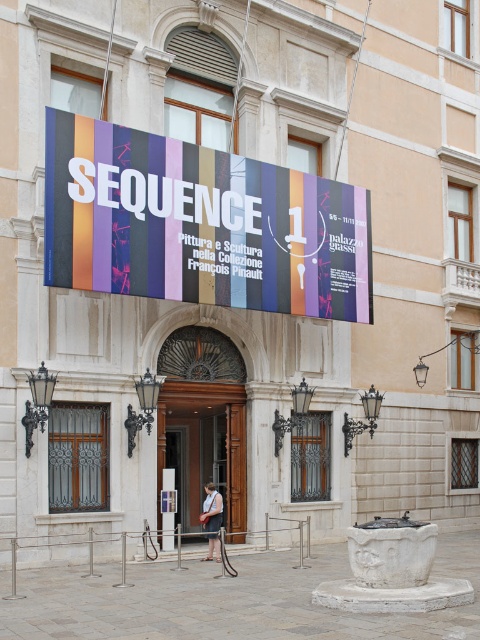
Question: Which point is closer to the camera taking this photo?

Choices:
 (A) (99, 227)
 (B) (216, 541)

Answer: (A)

Question: Does multicolored fabric banner at center have a greater width compared to white cotton dress at center?

Choices:
 (A) no
 (B) yes

Answer: (B)

Question: Is brown wooden door at center bigger than white cotton dress at center?

Choices:
 (A) yes
 (B) no

Answer: (A)

Question: Among these points, which one is farthest from the camera?

Choices:
 (A) (180, 416)
 (B) (69, 172)
 (C) (214, 502)

Answer: (A)

Question: Does multicolored fabric banner at center come in front of white cotton dress at center?

Choices:
 (A) yes
 (B) no

Answer: (A)

Question: Considering the real-world distances, which object is closest to the multicolored fabric banner at center?

Choices:
 (A) white cotton dress at center
 (B) brown wooden door at center

Answer: (B)